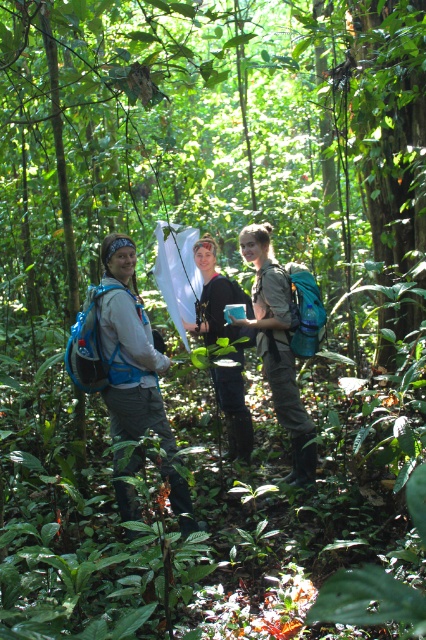
Question: Estimate the real-world distances between objects in this image. Which object is closer to the matte blue backpack at left?

Choices:
 (A) blue fabric backpack at left
 (B) matte blue backpack at center

Answer: (A)

Question: Is blue fabric backpack at left above matte blue backpack at left?

Choices:
 (A) no
 (B) yes

Answer: (A)

Question: Does blue fabric backpack at left appear on the left side of matte blue backpack at center?

Choices:
 (A) yes
 (B) no

Answer: (A)

Question: Which of the following is the closest to the observer?

Choices:
 (A) (150, 400)
 (B) (72, 337)
 (C) (259, 236)
 (D) (206, 339)

Answer: (B)

Question: Which point is farther from the camera taking this photo?

Choices:
 (A) (268, 304)
 (B) (238, 330)
 (C) (132, 504)

Answer: (B)

Question: Is blue fabric backpack at left to the right of black matte shirt at center from the viewer's perspective?

Choices:
 (A) yes
 (B) no

Answer: (B)